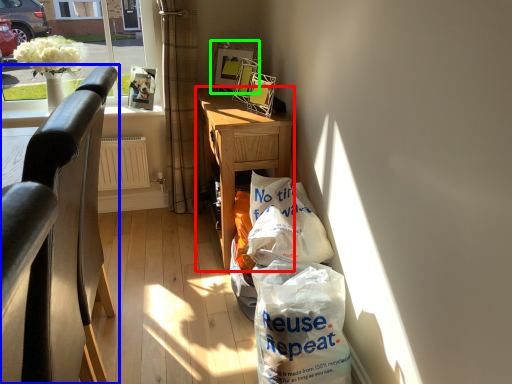
Question: Which object is the farthest from desk (highlighted by a red box)? Choose among these: chair (highlighted by a blue box) or picture frame (highlighted by a green box).

Choices:
 (A) chair
 (B) picture frame

Answer: (A)